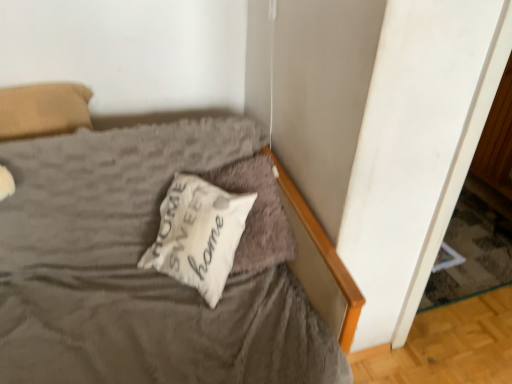
Question: Could you tell me if white soft pillow at center, which is the 2th pillow in right-to-left order, is turned towards white soft pillow at center, placed as the 2th pillow when sorted from left to right?

Choices:
 (A) yes
 (B) no

Answer: (A)

Question: Does white soft pillow at center, which is the 2th pillow in right-to-left order, have a greater width compared to white soft pillow at center, placed as the 1th pillow when sorted from right to left?

Choices:
 (A) no
 (B) yes

Answer: (A)

Question: Is white soft pillow at center, which is the 2th pillow in right-to-left order, shorter than white soft pillow at center, placed as the 1th pillow when sorted from right to left?

Choices:
 (A) no
 (B) yes

Answer: (B)

Question: Is white soft pillow at center, acting as the 1th pillow starting from the left, to the right of white soft pillow at center, placed as the 1th pillow when sorted from right to left, from the viewer's perspective?

Choices:
 (A) yes
 (B) no

Answer: (B)

Question: Is white soft pillow at center, acting as the 1th pillow starting from the left, with white soft pillow at center, placed as the 1th pillow when sorted from right to left?

Choices:
 (A) no
 (B) yes

Answer: (A)

Question: From a real-world perspective, is white soft pillow at center, acting as the 1th pillow starting from the left, located higher than white soft pillow at center, placed as the 2th pillow when sorted from left to right?

Choices:
 (A) no
 (B) yes

Answer: (B)

Question: Can we say white soft pillow at center, placed as the 1th pillow when sorted from right to left, lies outside white soft pillow at center, which is the 2th pillow in right-to-left order?

Choices:
 (A) yes
 (B) no

Answer: (B)

Question: Can you confirm if white soft pillow at center, placed as the 1th pillow when sorted from right to left, is wider than white soft pillow at center, which is the 2th pillow in right-to-left order?

Choices:
 (A) yes
 (B) no

Answer: (A)

Question: From the image's perspective, is white soft pillow at center, placed as the 2th pillow when sorted from left to right, over white soft pillow at center, which is the 2th pillow in right-to-left order?

Choices:
 (A) no
 (B) yes

Answer: (B)

Question: Is white soft pillow at center, which is the 2th pillow in right-to-left order, at the back of white soft pillow at center, placed as the 1th pillow when sorted from right to left?

Choices:
 (A) no
 (B) yes

Answer: (B)

Question: Is white soft pillow at center, placed as the 1th pillow when sorted from right to left, shorter than white soft pillow at center, acting as the 1th pillow starting from the left?

Choices:
 (A) no
 (B) yes

Answer: (A)

Question: Is white soft pillow at center, placed as the 1th pillow when sorted from right to left, next to white soft pillow at center, which is the 2th pillow in right-to-left order?

Choices:
 (A) yes
 (B) no

Answer: (B)

Question: Do you think white soft pillow at center, placed as the 2th pillow when sorted from left to right, is within white soft pillow at center, which is the 2th pillow in right-to-left order, or outside of it?

Choices:
 (A) outside
 (B) inside

Answer: (B)